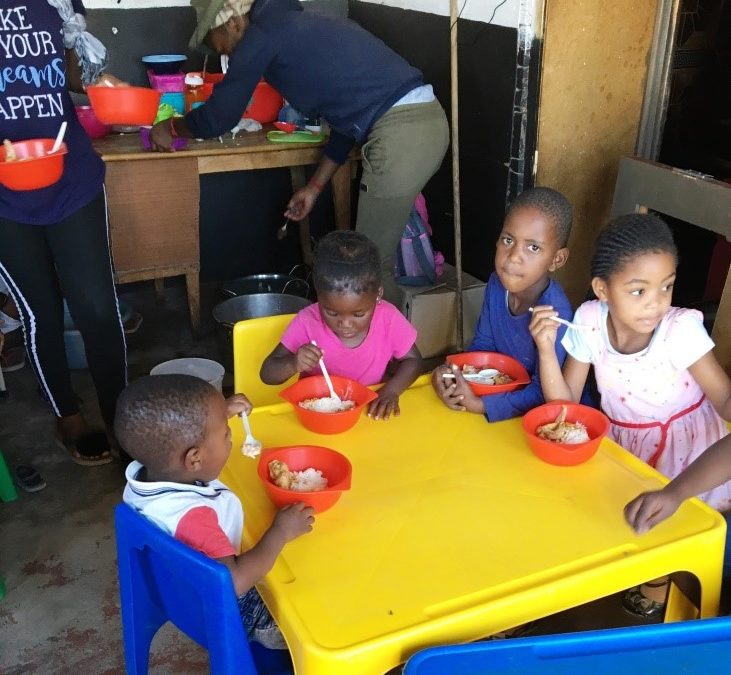
Identify the location of floor. (69, 616).